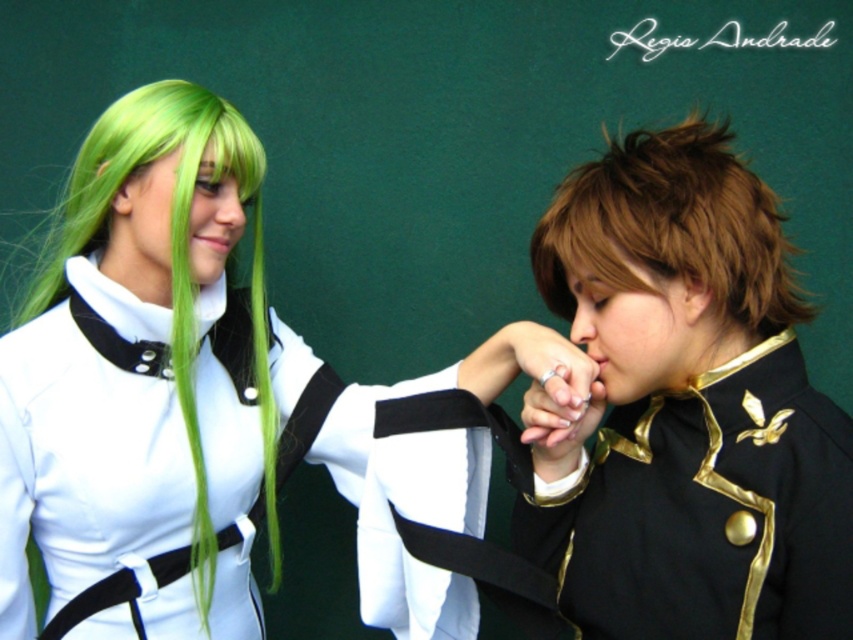
Question: Does matte white uniform at center appear on the left side of green silky wig at left?

Choices:
 (A) yes
 (B) no

Answer: (B)

Question: Which of these objects is positioned farthest from the matte white uniform at center?

Choices:
 (A) green silky wig at left
 (B) brown shiny hair at center

Answer: (B)

Question: Which object is the farthest from the green silky wig at left?

Choices:
 (A) brown shiny hair at center
 (B) shiny gold uniform at center
 (C) matte white uniform at center

Answer: (A)

Question: Does shiny gold uniform at center have a greater width compared to green silky wig at left?

Choices:
 (A) no
 (B) yes

Answer: (A)

Question: Does matte white uniform at center appear over green silky wig at left?

Choices:
 (A) yes
 (B) no

Answer: (B)

Question: Based on their relative distances, which object is farther from the green silky wig at left?

Choices:
 (A) matte white uniform at center
 (B) shiny gold uniform at center

Answer: (B)